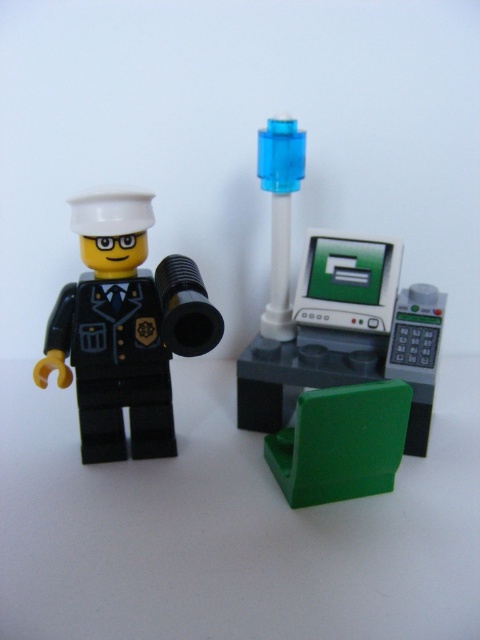
You are a Lego character trying to sit down on the green plastic chair at lower center. Can you reach the chair without moving the black matte minifigure at left?

The black matte minifigure at left is positioned over green plastic chair at lower center, so you cannot reach the chair without moving the minifigure first.

You are a Lego figure trying to reach the transparent blue cylinder at center from your current position near the black matte minifigure at left. Can you simply walk straight ahead to reach it without moving sideways?

The black matte minifigure at left is below the transparent blue cylinder at center, so walking straight ahead should allow you to reach the transparent blue cylinder at center without needing to move sideways.